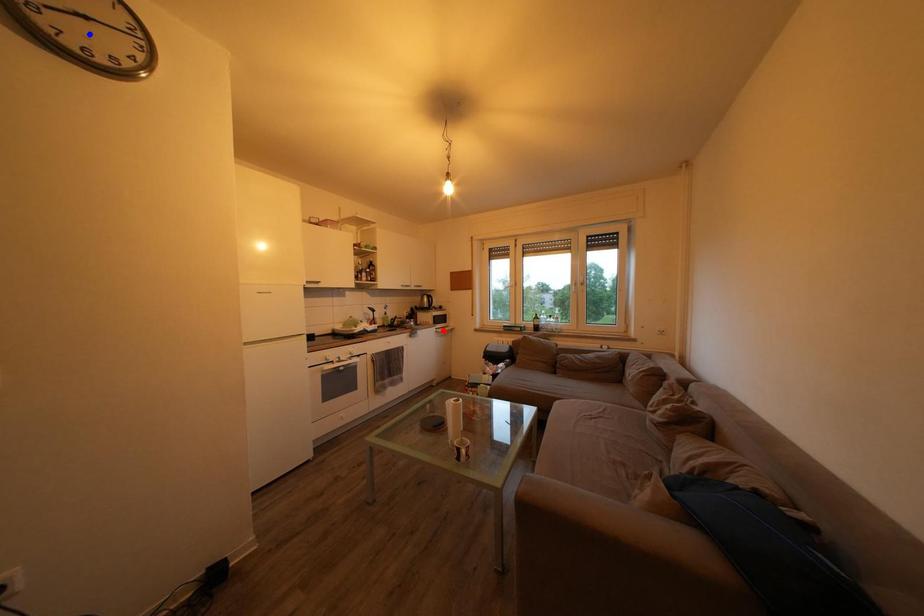
Question: Which of the two points in the image is closer to the camera?

Choices:
 (A) Blue point is closer.
 (B) Red point is closer.

Answer: (A)